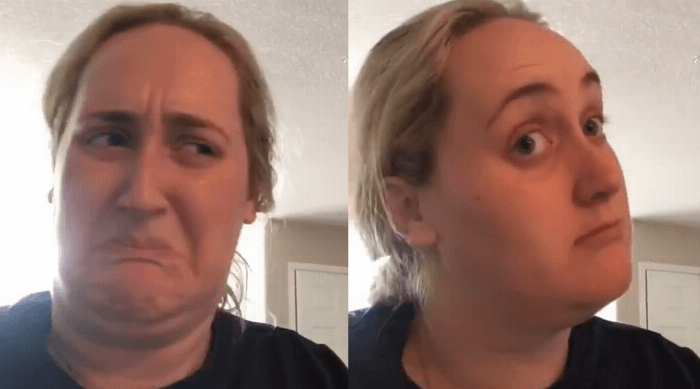
Identify the location of popcorn ceiling left pic. This screenshot has width=700, height=389. (204, 200).